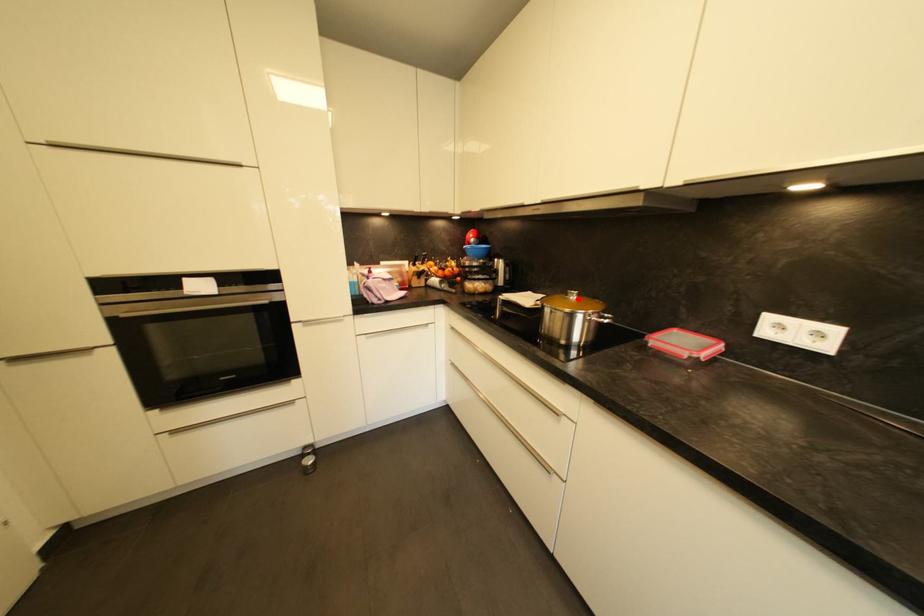
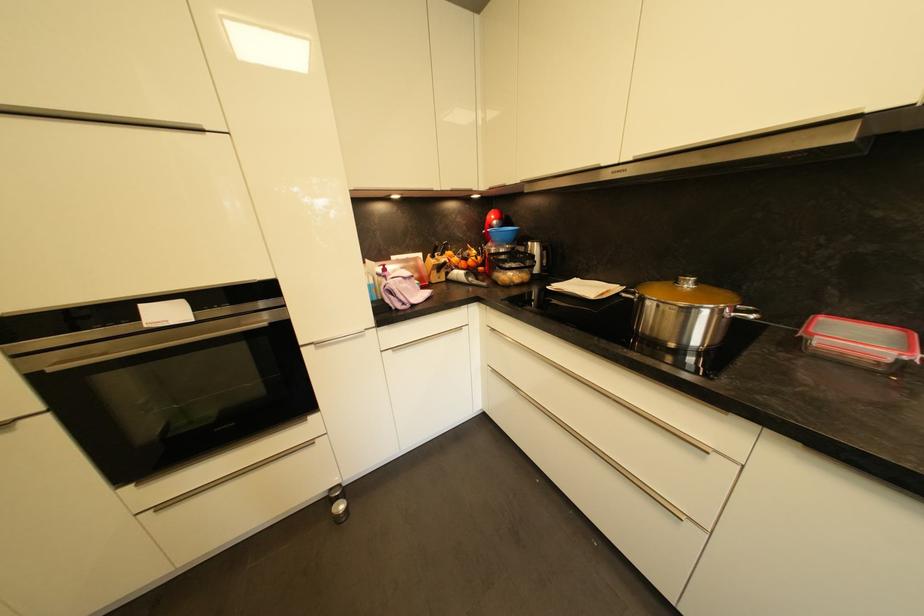
Find the pixel in the second image that matches the highlighted location in the first image.

(694, 286)